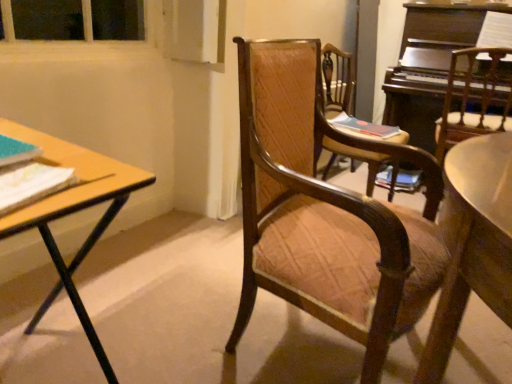
Question: Does matte blue book at left, which is the 2th book in bottom-to-top order, lie behind wooden textured chair at center, which appears as the second chair when viewed from the right?

Choices:
 (A) yes
 (B) no

Answer: (B)

Question: Considering the relative sizes of matte blue book at left, positioned as the 1th book in left-to-right order, and wooden textured chair at center, which is counted as the second chair, starting from the left, in the image provided, is matte blue book at left, positioned as the 1th book in left-to-right order, smaller than wooden textured chair at center, which is counted as the second chair, starting from the left,?

Choices:
 (A) yes
 (B) no

Answer: (A)

Question: From a real-world perspective, is matte blue book at left, the 3th book in the right-to-left sequence, positioned under wooden textured chair at center, which appears as the second chair when viewed from the right, based on gravity?

Choices:
 (A) no
 (B) yes

Answer: (A)

Question: Considering the relative sizes of matte blue book at left, the 3th book in the right-to-left sequence, and wooden textured chair at center, which appears as the second chair when viewed from the right, in the image provided, is matte blue book at left, the 3th book in the right-to-left sequence, bigger than wooden textured chair at center, which appears as the second chair when viewed from the right,?

Choices:
 (A) no
 (B) yes

Answer: (A)

Question: Is matte blue book at left, positioned as the 1th book in left-to-right order, looking in the opposite direction of wooden textured chair at center, which appears as the second chair when viewed from the right?

Choices:
 (A) yes
 (B) no

Answer: (B)

Question: Looking at their shapes, would you say white paper at left, acting as the 3th book starting from the top, is wider or thinner than wooden chair at center, the 3th chair in the right-to-left sequence?

Choices:
 (A) thin
 (B) wide

Answer: (A)

Question: From a real-world perspective, is white paper at left, acting as the 3th book starting from the top, physically located above or below wooden chair at center, the 3th chair in the right-to-left sequence?

Choices:
 (A) below
 (B) above

Answer: (B)

Question: From their relative heights in the image, would you say white paper at left, which is the first book from bottom to top, is taller or shorter than wooden chair at center, the 3th chair in the right-to-left sequence?

Choices:
 (A) short
 (B) tall

Answer: (A)

Question: Choose the correct answer: Is white paper at left, which is the 3th book from back to front, inside wooden chair at center, the 3th chair in the right-to-left sequence, or outside it?

Choices:
 (A) outside
 (B) inside

Answer: (A)

Question: From the image's perspective, is wooden chair at center, marked as the 1th chair in a left-to-right arrangement, located above or below white paper at left, which is the 3th book from back to front?

Choices:
 (A) above
 (B) below

Answer: (B)

Question: Choose the correct answer: Is wooden chair at center, the 3th chair in the right-to-left sequence, inside white paper at left, placed as the second book when sorted from right to left, or outside it?

Choices:
 (A) inside
 (B) outside

Answer: (B)

Question: Considering the positions of point (316, 221) and point (13, 173), is point (316, 221) closer or farther from the camera than point (13, 173)?

Choices:
 (A) farther
 (B) closer

Answer: (A)

Question: Based on their sizes in the image, would you say wooden chair at center, the 3th chair in the right-to-left sequence, is bigger or smaller than white paper at left, the second book positioned from the left?

Choices:
 (A) big
 (B) small

Answer: (A)

Question: From their relative heights in the image, would you say wooden textured chair at center, which appears as the second chair when viewed from the right, is taller or shorter than matte blue book at left, the 2th book from the front?

Choices:
 (A) short
 (B) tall

Answer: (B)

Question: In terms of width, does wooden textured chair at center, which appears as the second chair when viewed from the right, look wider or thinner when compared to matte blue book at left, the 2th book from the front?

Choices:
 (A) wide
 (B) thin

Answer: (A)